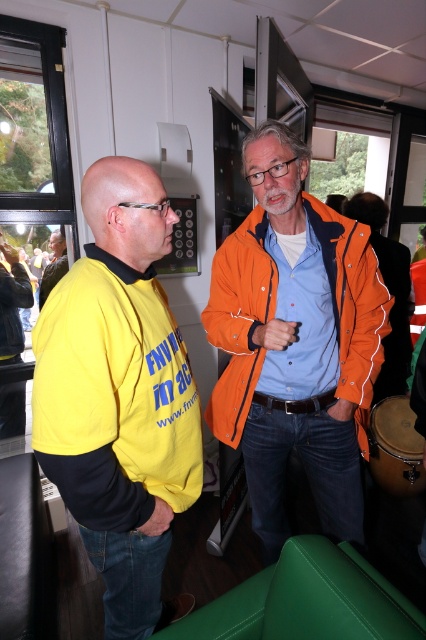
Which is below, orange fabric jacket at center or brown leather drum at lower right?

brown leather drum at lower right

Between orange fabric jacket at center and brown leather drum at lower right, which one has more height?

orange fabric jacket at center is taller.

Does point (397, 268) come closer to viewer compared to point (405, 433)?

No, it is not.

Identify the location of orange fabric jacket at center. (388, 291).

Can you confirm if yellow matte t-shirt at left is positioned below brown leather drum at lower right?

No, yellow matte t-shirt at left is not below brown leather drum at lower right.

Based on the photo, does yellow matte t-shirt at left appear over brown leather drum at lower right?

Correct, yellow matte t-shirt at left is located above brown leather drum at lower right.

Who is more distant from viewer, (x=164, y=428) or (x=380, y=403)?

The point (x=380, y=403) is more distant.

At what (x,y) coordinates should I click in order to perform the action: click on yellow matte t-shirt at left. Please return your answer as a coordinate pair (x, y). The width and height of the screenshot is (426, 640). Looking at the image, I should click on (x=118, y=394).

Is yellow matte t-shirt at left taller than orange fabric jacket at center?

Indeed, yellow matte t-shirt at left has a greater height compared to orange fabric jacket at center.

In the scene shown: Is yellow matte t-shirt at left above orange fabric jacket at center?

Actually, yellow matte t-shirt at left is below orange fabric jacket at center.

I want to click on yellow matte t-shirt at left, so click(x=118, y=394).